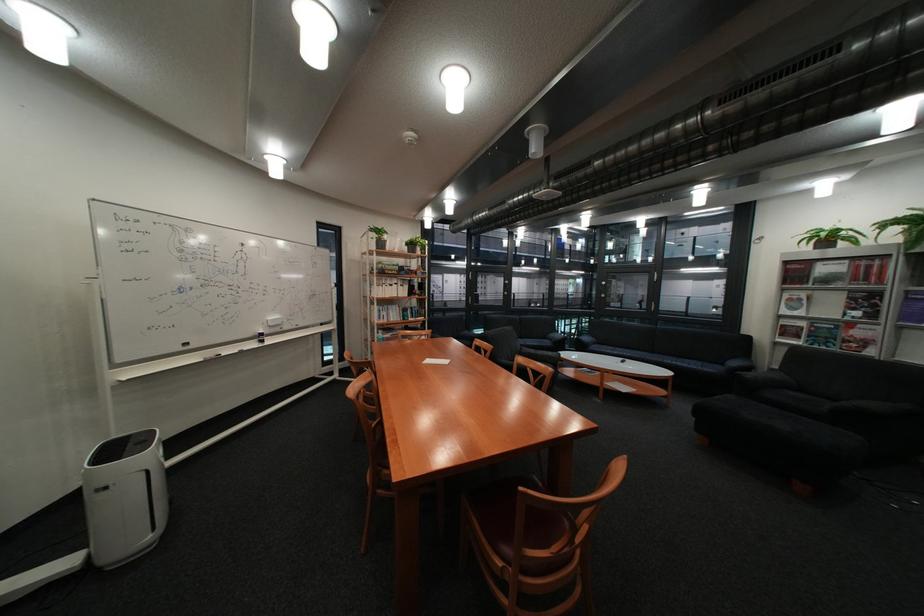
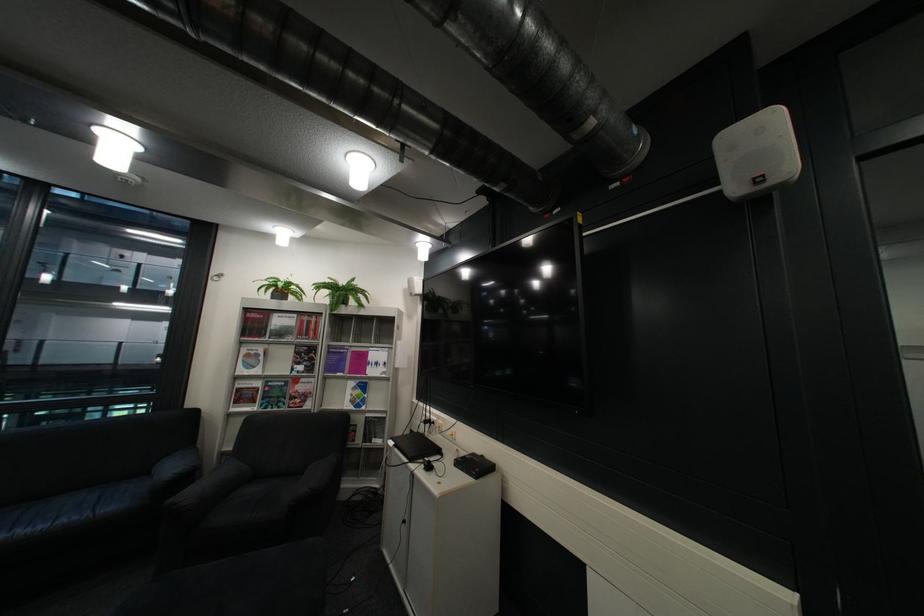
Find the pixel in the second image that matches [700,365] in the first image.

(58, 527)